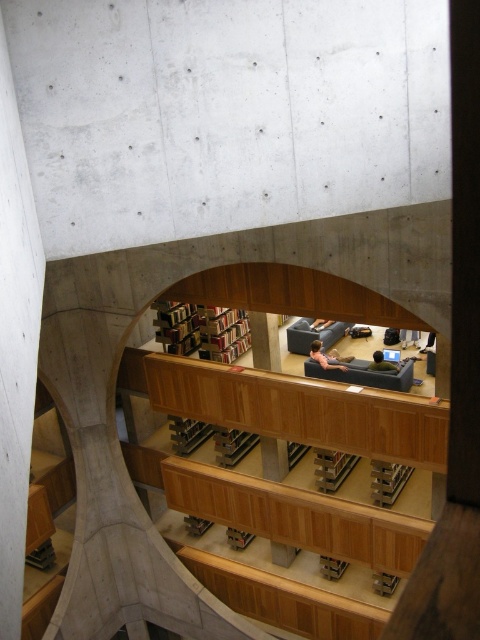
You are an architect designing a new library. You need to place a 2.5 meter wide sculpture between the wooden stairs at center and the wooden bookshelf at center. Based on the image, will the sculpture fit between them?

The wooden stairs at center has a lesser width compared to wooden bookshelf at center. Since the sculpture is 2.5 meters wide, and the space between them depends on their widths, but the exact distance isn not provided. However, since the stairs are narrower than the bookshelf, it might not be sufficient. Without precise measurements, it is uncertain if the sculpture will fit.

You are standing in the modern architectural space and want to take a photo. You notice two points marked in the scene. Which of the two points, point (24, 420) or point (204, 336), will appear larger in your camera view because it is closer to you?

Point (24, 420) is closer to the camera than point (204, 336), so it will appear larger in the camera view.